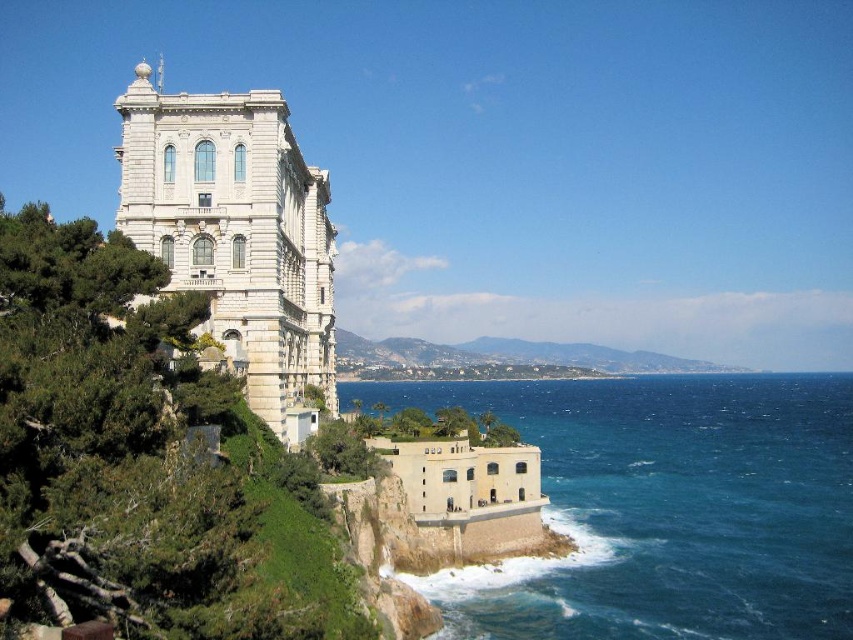
Question: Which object is closer to the camera taking this photo?

Choices:
 (A) blue water at lower right
 (B) white stone building at upper left

Answer: (B)

Question: Does blue water at lower right appear over white stone building at upper left?

Choices:
 (A) yes
 (B) no

Answer: (B)

Question: Does blue water at lower right appear under white stone building at upper left?

Choices:
 (A) yes
 (B) no

Answer: (A)

Question: Which of the following is the closest to the observer?

Choices:
 (A) white stone building at upper left
 (B) blue water at lower right

Answer: (A)

Question: Is blue water at lower right positioned behind white stone building at upper left?

Choices:
 (A) yes
 (B) no

Answer: (A)